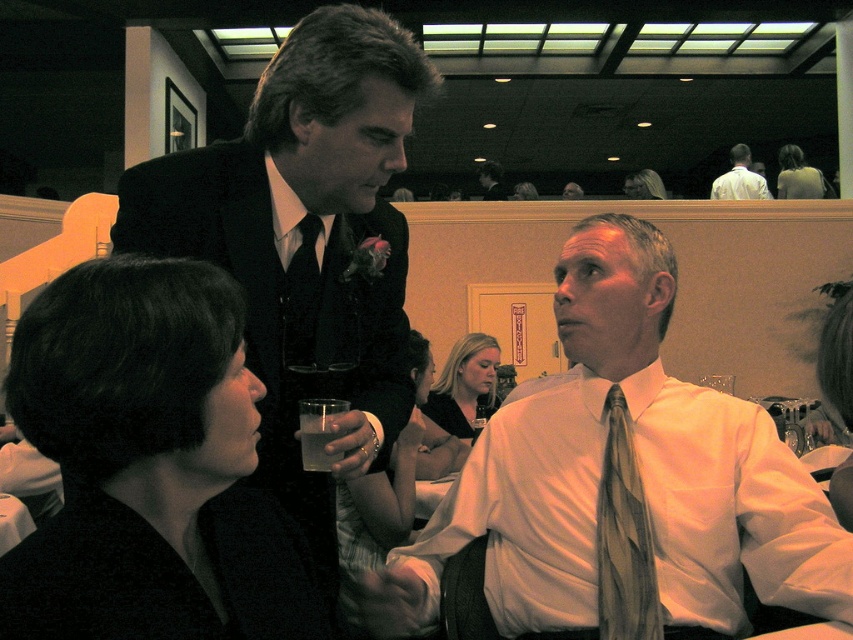
Does silky beige tie at center have a smaller size compared to translucent plastic cup at lower center?

No, silky beige tie at center is not smaller than translucent plastic cup at lower center.

Who is more distant from viewer, [622,627] or [320,436]?

The point [622,627] is behind.

Image resolution: width=853 pixels, height=640 pixels. What are the coordinates of `silky beige tie at center` in the screenshot? It's located at (624, 536).

Can you confirm if black fabric at upper left is thinner than matte black suit at upper left?

Correct, black fabric at upper left's width is less than matte black suit at upper left's.

Locate an element on the screen. This screenshot has width=853, height=640. black fabric at upper left is located at coordinates (148, 465).

Where is `black fabric at upper left`? black fabric at upper left is located at coordinates (148, 465).

Can you confirm if black fabric at upper left is positioned below translucent plastic cup at lower center?

Actually, black fabric at upper left is above translucent plastic cup at lower center.

Locate an element on the screen. black fabric at upper left is located at coordinates (148, 465).